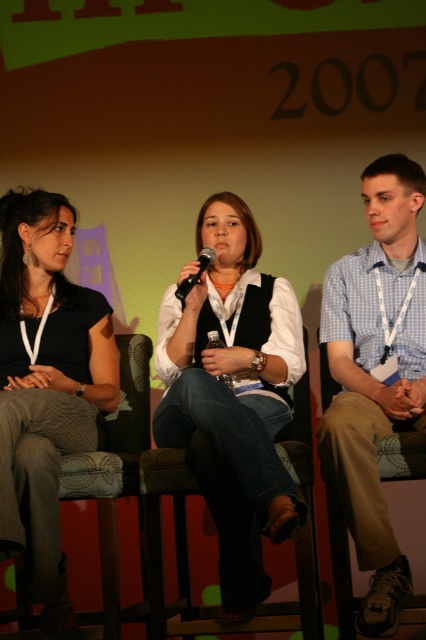
Question: Considering the real-world distances, which object is closest to the black matte microphone at center?

Choices:
 (A) brown fabric chair at center
 (B) matte black top at left

Answer: (B)

Question: Can you confirm if blue checkered shirt at center is thinner than brown fabric chair at center?

Choices:
 (A) no
 (B) yes

Answer: (B)

Question: Which object appears farthest from the camera in this image?

Choices:
 (A) matte black top at left
 (B) blue checkered shirt at center

Answer: (A)

Question: Is matte black top at left below black matte microphone at center?

Choices:
 (A) yes
 (B) no

Answer: (A)

Question: Observing the image, what is the correct spatial positioning of matte black top at left in reference to brown fabric chair at center?

Choices:
 (A) right
 (B) left

Answer: (B)

Question: Which point appears farthest from the camera in this image?

Choices:
 (A) (311, 480)
 (B) (189, 289)
 (C) (14, 348)
 (D) (359, 620)

Answer: (C)